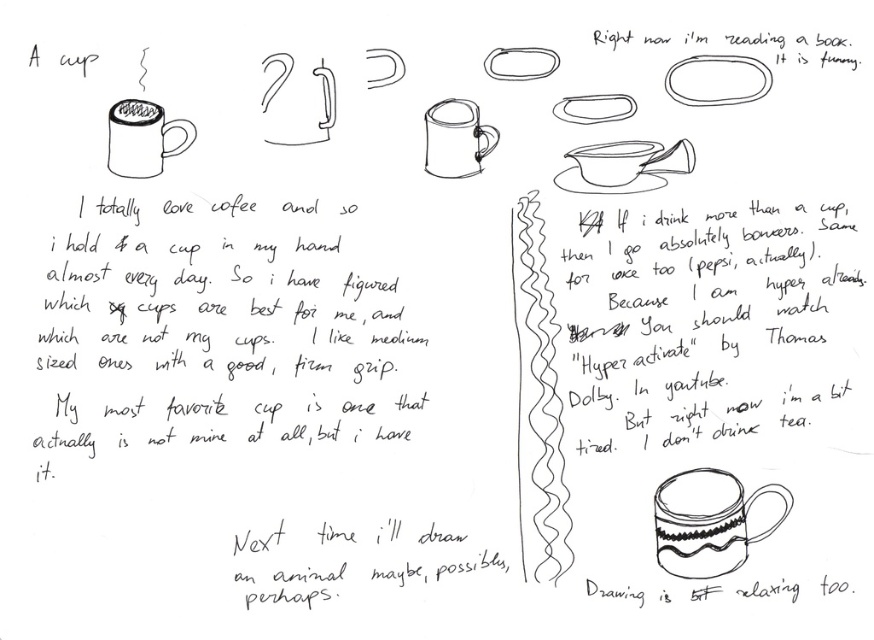
Question: Based on their relative distances, which object is nearer to the matte ceramic mug at upper left?

Choices:
 (A) white matte saucer at upper center
 (B) black paper at upper center
 (C) matte ceramic mug at center
 (D) speckled ceramic mug at lower right

Answer: (C)

Question: Can you confirm if matte ceramic mug at upper left is positioned to the right of white matte saucer at upper center?

Choices:
 (A) yes
 (B) no

Answer: (B)

Question: Which object is farther from the camera taking this photo?

Choices:
 (A) matte ceramic mug at upper left
 (B) speckled ceramic mug at lower right

Answer: (A)

Question: Is black paper at upper center wider than matte ceramic mug at upper left?

Choices:
 (A) no
 (B) yes

Answer: (B)

Question: Which point is farther from the camera taking this photo?

Choices:
 (A) (656, 550)
 (B) (571, 380)
 (C) (123, 177)

Answer: (B)

Question: Can you confirm if speckled ceramic mug at lower right is bigger than matte ceramic mug at upper left?

Choices:
 (A) yes
 (B) no

Answer: (A)